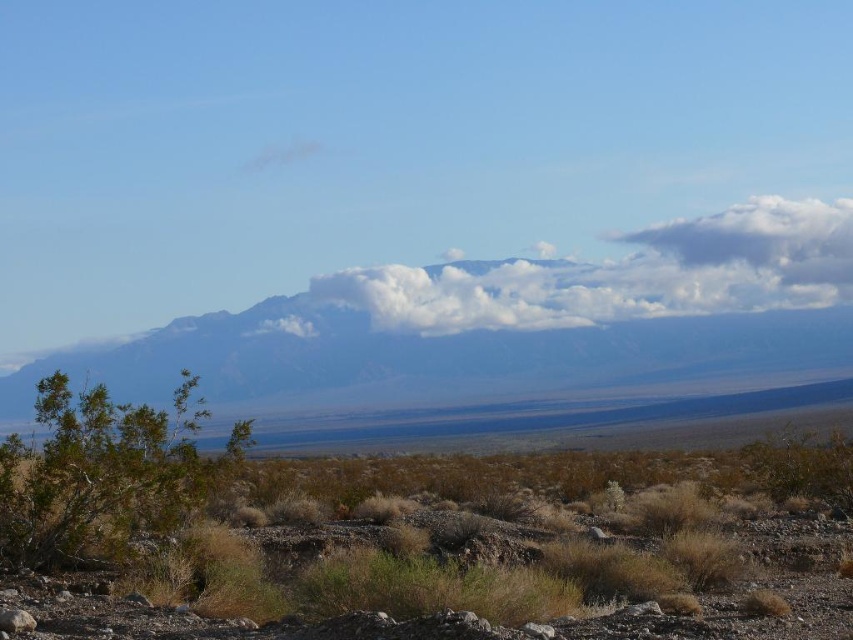
Question: Which object is closer to the camera taking this photo?

Choices:
 (A) brown dry grass at lower left
 (B) white fluffy cloud at center

Answer: (A)

Question: Is white fluffy cloud at center wider than green leafy bush at lower left?

Choices:
 (A) yes
 (B) no

Answer: (A)

Question: Is the position of brown dry grass at lower left more distant than that of white fluffy cloud at center?

Choices:
 (A) yes
 (B) no

Answer: (B)

Question: Which is nearer to the brown dry grass at lower left?

Choices:
 (A) green leafy bush at lower left
 (B) white fluffy cloud at center

Answer: (A)

Question: Among these points, which one is farthest from the camera?

Choices:
 (A) (177, 442)
 (B) (740, 218)
 (C) (830, 490)

Answer: (B)

Question: Does white fluffy cloud at center appear under green leafy bush at lower left?

Choices:
 (A) yes
 (B) no

Answer: (B)